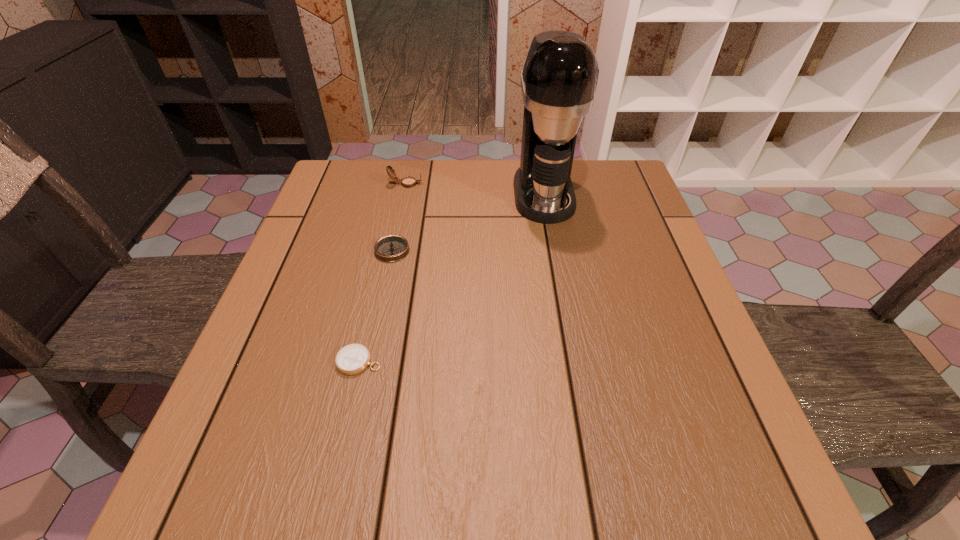
You are a GUI agent. You are given a task and a screenshot of the screen. Output one action in this format:
    pyautogui.click(x=<x>, y=<y>)
    Task: Click on the tallest object
    The width and height of the screenshot is (960, 540).
    Given the screenshot: What is the action you would take?
    pyautogui.click(x=559, y=78)

Where is `coffee maker`? coffee maker is located at coordinates (559, 78).

Where is `the farthest compass`? the farthest compass is located at coordinates (408, 182).

Where is `the tallest compass`? The image size is (960, 540). the tallest compass is located at coordinates (408, 182).

Find the location of a particular element. The width and height of the screenshot is (960, 540). the second nearest object is located at coordinates (391, 248).

Locate an element on the screen. the nearest object is located at coordinates (352, 359).

I want to click on vacant space located 0.150m place cup under the spout of the coffee maker, so click(x=556, y=265).

Where is `vacant space situated 0.310m on the face of the second tallest object`? vacant space situated 0.310m on the face of the second tallest object is located at coordinates (535, 184).

I want to click on free location located on the back of the second nearest object, so click(x=409, y=172).

Find the location of a particular element. Image resolution: width=960 pixels, height=540 pixels. free region located 0.160m on the front of the nearest compass is located at coordinates (335, 465).